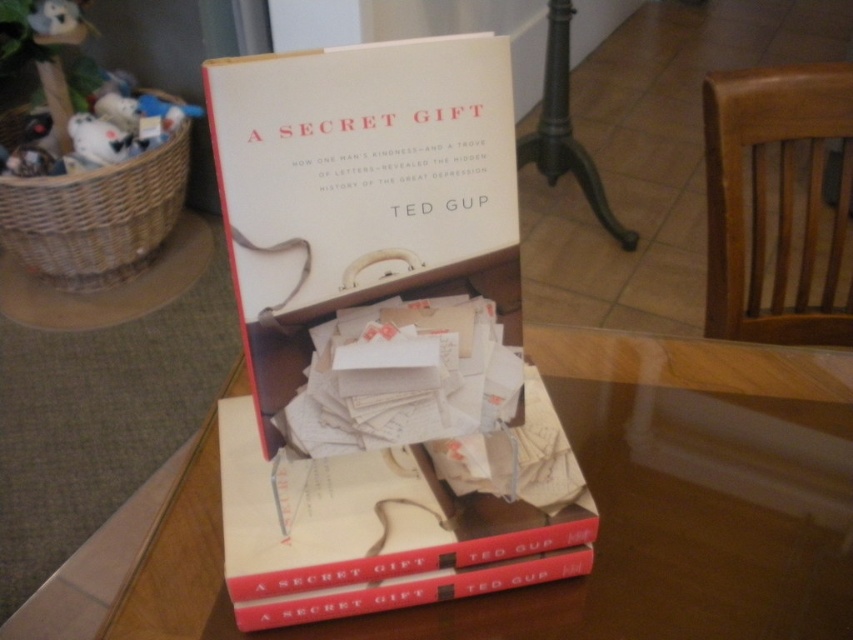
You are organizing a library shelf and need to place both the hardcover book at center and the woven brown basket at left. Since the shelf has limited space, which item should you place first to ensure both fit?

The hardcover book at center should be placed first because it occupies less space than the woven brown basket at left, allowing both items to fit on the shelf.

You are organizing items on a shelf and need to place the smooth wooden table at center and the woven brown basket at left. According to the image, which object should be placed to the right of the other?

The smooth wooden table at center should be placed to the right of the woven brown basket at left because the smooth wooden table at center is positioned on the right side of woven brown basket at left in the image.

You are organizing a library and need to place both the matte white book at center and the hardcover book at center on a shelf. According to their positions in the image, which book should be placed to the front so that both can be seen properly?

The matte white book at center should be placed to the front since it is closer to the viewer than the hardcover book at center, allowing both to be seen properly.